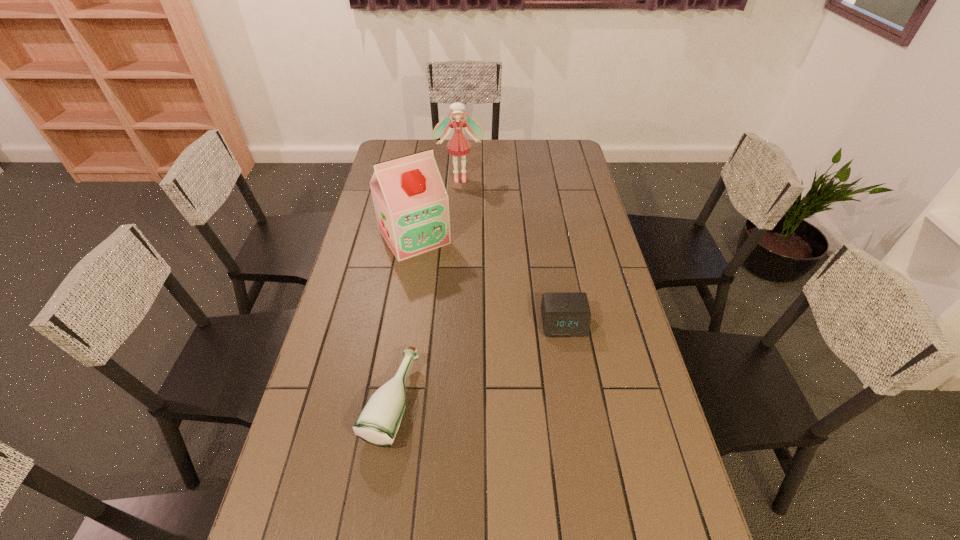
Find the location of a particular element. The image size is (960, 540). free space on the desktop that is between the bottle and the third farthest object and is positioned with the cap open on the second farthest object is located at coordinates (495, 354).

The width and height of the screenshot is (960, 540). Identify the location of vacant space on the desktop that is between the nearest object and the shortest object and is positioned on the front-facing side of the doll. (477, 363).